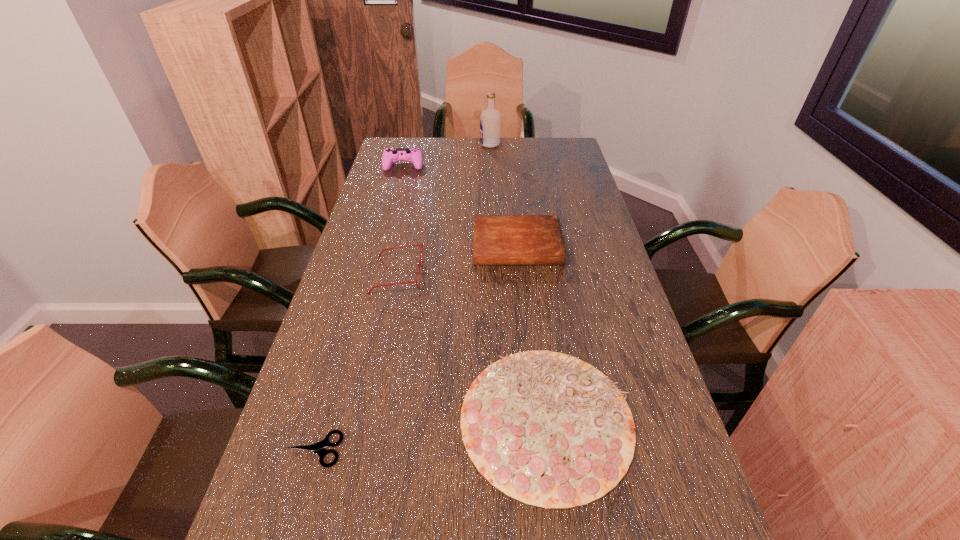
You are a GUI agent. You are given a task and a screenshot of the screen. Output one action in this format:
    pyautogui.click(x=<x>, y=<y>)
    Task: Click on the farthest object
    This screenshot has height=540, width=960.
    Given the screenshot: What is the action you would take?
    pyautogui.click(x=490, y=119)

At what (x,y) coordinates should I click in order to perform the action: click on the tallest object. Please return your answer as a coordinate pair (x, y). The image size is (960, 540). Looking at the image, I should click on (490, 119).

At what (x,y) coordinates should I click in order to perform the action: click on control. Please return your answer as a coordinate pair (x, y). Image resolution: width=960 pixels, height=540 pixels. Looking at the image, I should click on (414, 155).

The width and height of the screenshot is (960, 540). Find the location of `spectacles`. spectacles is located at coordinates (421, 244).

Locate an element on the screen. Bible is located at coordinates (498, 239).

You are a GUI agent. You are given a task and a screenshot of the screen. Output one action in this format:
    pyautogui.click(x=<x>, y=<y>)
    Task: Click on the pizza
    
    Given the screenshot: What is the action you would take?
    pyautogui.click(x=548, y=429)

Locate an element on the screen. The image size is (960, 540). shears is located at coordinates (318, 448).

I want to click on free space located 0.130m on the label of the vodka, so click(450, 144).

Find the location of a particular element. The height and width of the screenshot is (540, 960). free spot located 0.140m on the label of the vodka is located at coordinates (448, 144).

Find the location of a particular element. The image size is (960, 540). vacant space located on the label of the vodka is located at coordinates (460, 144).